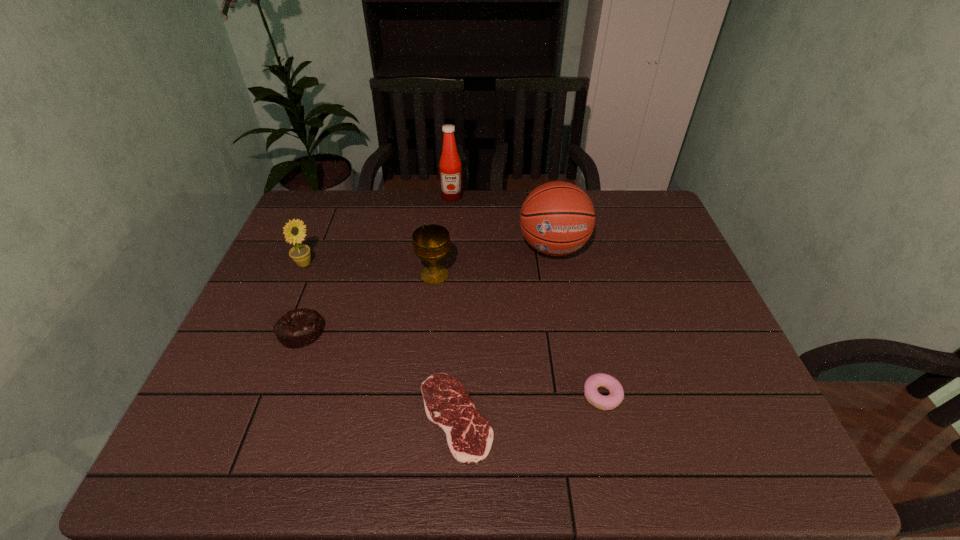
Where is `vacant point located between the beanbag and the shortest object`? vacant point located between the beanbag and the shortest object is located at coordinates (378, 374).

Identify the location of free point between the chalice and the shortest object. Image resolution: width=960 pixels, height=540 pixels. (445, 346).

Find the location of a particular element. The width and height of the screenshot is (960, 540). vacant space in between the condiment and the second tallest object is located at coordinates (502, 222).

Where is `vacant region between the doughnut and the steak`? vacant region between the doughnut and the steak is located at coordinates (529, 406).

Identify the location of free spot between the shortest object and the farthest object. (454, 306).

Select which object is the closest to the chalice. Please provide its 2D coordinates. Your answer should be formatted as a tuple, i.e. [(x, y)], where the tuple contains the x and y coordinates of a point satisfying the conditions above.

[(557, 218)]

Find the location of a particular element. The image size is (960, 540). object that is the fifth nearest to the beanbag is located at coordinates (450, 166).

The height and width of the screenshot is (540, 960). I want to click on vacant space that satisfies the following two spatial constraints: 1. on the logo side of the doughnut; 2. on the left side of the basketball, so click(580, 396).

The height and width of the screenshot is (540, 960). Find the location of `vacant space that satisfies the following two spatial constraints: 1. on the front side of the doughnut; 2. on the right side of the chalice`. vacant space that satisfies the following two spatial constraints: 1. on the front side of the doughnut; 2. on the right side of the chalice is located at coordinates (421, 396).

At what (x,y) coordinates should I click in order to perform the action: click on vacant space that satisfies the following two spatial constraints: 1. on the logo side of the second tallest object; 2. on the right side of the sixth tallest object. Please return your answer as a coordinate pair (x, y). The image size is (960, 540). Looking at the image, I should click on (580, 396).